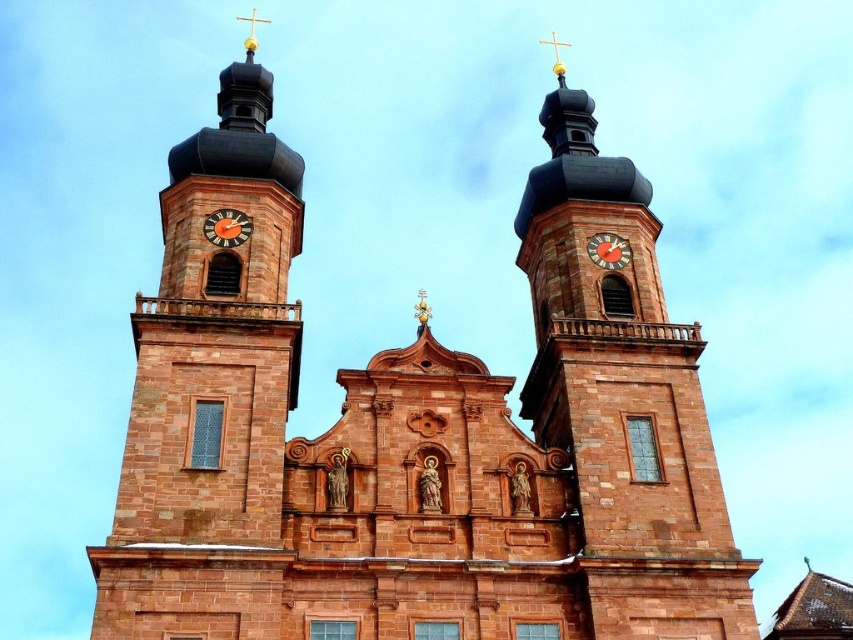
You are an architect assessing the church facade. You need to determine which object occupies a larger area on the facade between the brown stone tower at center and the orange metallic clock at upper left. Based on the architectural details provided, which one is bigger?

The brown stone tower at center is bigger than the orange metallic clock at upper left according to the description.

You are an architect examining the church facade. You notice the brown stone tower at center and the orange metallic clock at upper left. Which object is positioned higher on the facade?

The brown stone tower at center is positioned higher than the orange metallic clock at upper left.